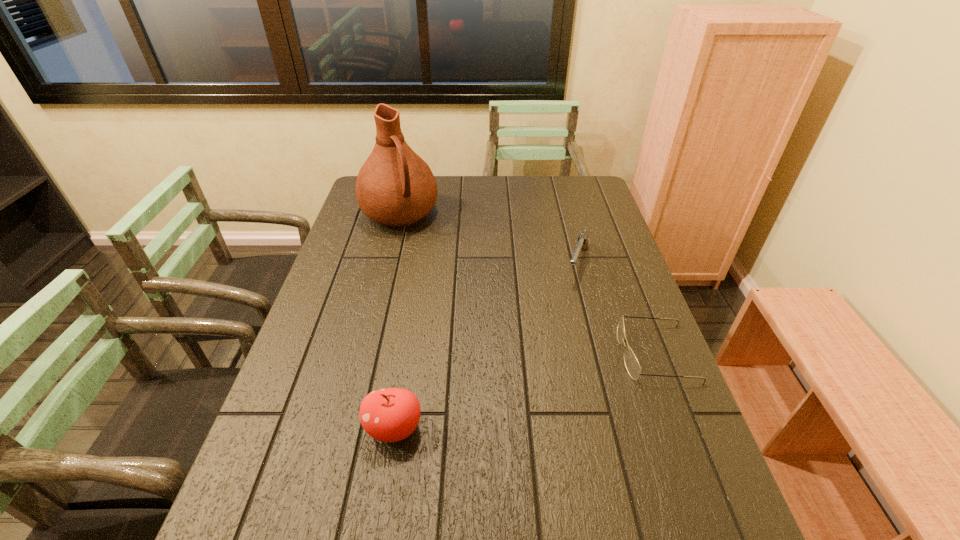
Where is `vacant point located between the pitcher and the gun`? The width and height of the screenshot is (960, 540). vacant point located between the pitcher and the gun is located at coordinates (x=489, y=239).

What are the coordinates of `free point between the second shortest object and the second nearest object` in the screenshot? It's located at (616, 308).

The image size is (960, 540). In order to click on blank region between the third shortest object and the pitcher in this screenshot , I will do `click(397, 321)`.

Find the location of `free space between the third object from left to right and the apple`. free space between the third object from left to right and the apple is located at coordinates (486, 346).

Locate an element on the screen. Image resolution: width=960 pixels, height=540 pixels. free space between the shortest object and the second object from right to left is located at coordinates (616, 308).

Locate an element on the screen. The image size is (960, 540). vacant point located between the pitcher and the shortest object is located at coordinates (528, 284).

Identify the location of free space between the shortest object and the tallest object. The image size is (960, 540). (528, 284).

I want to click on the third closest object to the nearest object, so click(x=395, y=187).

Identify which object is the second closest to the tallest object. Please provide its 2D coordinates. Your answer should be formatted as a tuple, i.e. [(x, y)], where the tuple contains the x and y coordinates of a point satisfying the conditions above.

[(632, 365)]

The image size is (960, 540). I want to click on free space that satisfies the following two spatial constraints: 1. on the back side of the apple; 2. on the front-facing side of the shortest object, so click(x=406, y=354).